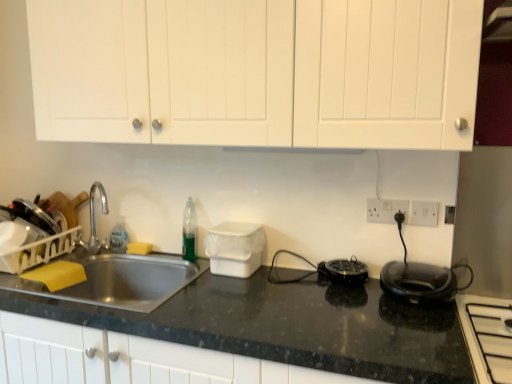
Question: Can we say white plastic electric outlet at upper right, marked as the first electric outlet in a right-to-left arrangement, lies outside white plastic container at center, the first appliance viewed from the left?

Choices:
 (A) no
 (B) yes

Answer: (B)

Question: Is white plastic electric outlet at upper right, positioned as the second electric outlet in left-to-right order, smaller than white plastic container at center, the first appliance viewed from the left?

Choices:
 (A) no
 (B) yes

Answer: (B)

Question: Is white plastic electric outlet at upper right, marked as the first electric outlet in a right-to-left arrangement, directly adjacent to white plastic container at center, the second appliance when ordered from right to left?

Choices:
 (A) no
 (B) yes

Answer: (A)

Question: From the image's perspective, is white plastic electric outlet at upper right, positioned as the second electric outlet in left-to-right order, over white plastic container at center, the second appliance when ordered from right to left?

Choices:
 (A) yes
 (B) no

Answer: (A)

Question: Does white plastic electric outlet at upper right, positioned as the second electric outlet in left-to-right order, have a greater width compared to white plastic container at center, the second appliance when ordered from right to left?

Choices:
 (A) yes
 (B) no

Answer: (B)

Question: From a real-world perspective, is white plastic electric outlet at upper right, positioned as the second electric outlet in left-to-right order, physically below white plastic container at center, the first appliance viewed from the left?

Choices:
 (A) no
 (B) yes

Answer: (A)

Question: Is white matte cabinet doors at upper center to the left of white glossy stovetop at lower right from the viewer's perspective?

Choices:
 (A) yes
 (B) no

Answer: (A)

Question: Is the depth of white matte cabinet doors at upper center greater than that of white glossy stovetop at lower right?

Choices:
 (A) yes
 (B) no

Answer: (A)

Question: Is white glossy stovetop at lower right completely or partially inside white matte cabinet doors at upper center?

Choices:
 (A) no
 (B) yes

Answer: (A)

Question: Is white matte cabinet doors at upper center next to white glossy stovetop at lower right and touching it?

Choices:
 (A) no
 (B) yes

Answer: (A)

Question: Is white matte cabinet doors at upper center facing towards white glossy stovetop at lower right?

Choices:
 (A) yes
 (B) no

Answer: (B)

Question: Can you confirm if white matte cabinet doors at upper center is shorter than white glossy stovetop at lower right?

Choices:
 (A) yes
 (B) no

Answer: (B)

Question: From a real-world perspective, is black plastic appliance at center, the second appliance in the left-to-right sequence, beneath translucent green bottle at sink?

Choices:
 (A) no
 (B) yes

Answer: (B)